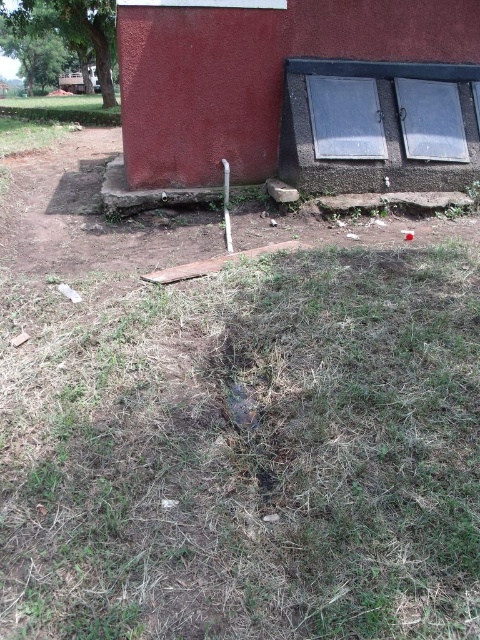
Question: Does brown dry grass at center appear under smooth red barn at center?

Choices:
 (A) no
 (B) yes

Answer: (B)

Question: Can you confirm if brown dry grass at center is positioned to the right of smooth red barn at center?

Choices:
 (A) no
 (B) yes

Answer: (A)

Question: Which of the following is the farthest from the observer?

Choices:
 (A) brown dry grass at center
 (B) smooth red barn at center

Answer: (B)

Question: Which of the following is the closest to the observer?

Choices:
 (A) brown dry grass at center
 (B) smooth red barn at center

Answer: (A)

Question: Among these points, which one is nearest to the camera?

Choices:
 (A) (197, 369)
 (B) (402, 8)

Answer: (A)

Question: Is brown dry grass at center bigger than smooth red barn at center?

Choices:
 (A) yes
 (B) no

Answer: (A)